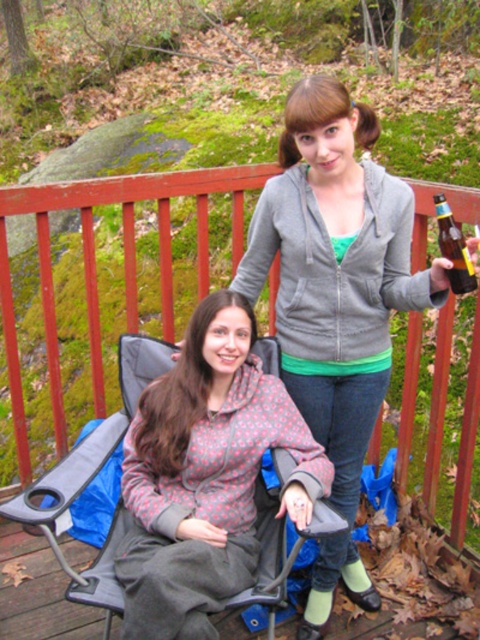
You are standing at the center of the deck and want to locate the matte gray hoodie at upper center. According to the coordinates provided, in which direction should you look to find it?

The matte gray hoodie at upper center is located at coordinates point (322, 115), so you should look towards the upper center direction to find it.

You are standing at the origin point of the coordinate system. The floral patterned hoodie at center is located at point (205, 476). If you want to walk towards the floral patterned hoodie at center, in which direction should you move?

The floral patterned hoodie at center is located at point (205, 476). Since the coordinate system is not specified, but assuming standard Cartesian coordinates where positive x is right and positive y is up, moving towards the hoodie would require moving right and up from the origin.